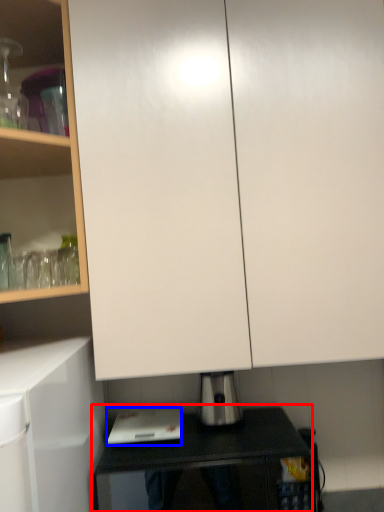
Question: Which object appears closest to the camera in this image, table (highlighted by a red box) or home appliance (highlighted by a blue box)?

Choices:
 (A) table
 (B) home appliance

Answer: (A)